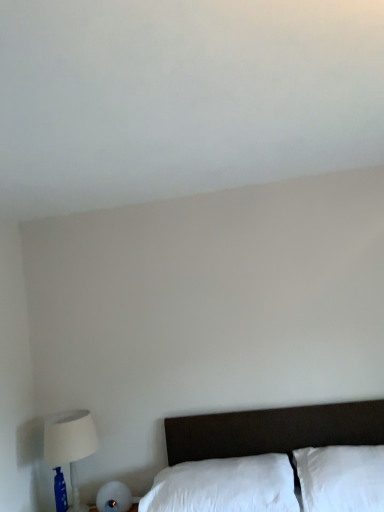
Question: From a real-world perspective, is white soft pillow at lower center, positioned as the 1th pillow in left-to-right order, located beneath white fabric lampshade at left?

Choices:
 (A) no
 (B) yes

Answer: (B)

Question: Is white soft pillow at lower center, the second pillow in the right-to-left sequence, smaller than white fabric lampshade at left?

Choices:
 (A) no
 (B) yes

Answer: (A)

Question: Considering the relative sizes of white soft pillow at lower center, the second pillow in the right-to-left sequence, and white fabric lampshade at left in the image provided, is white soft pillow at lower center, the second pillow in the right-to-left sequence, bigger than white fabric lampshade at left?

Choices:
 (A) yes
 (B) no

Answer: (A)

Question: From the image's perspective, is white soft pillow at lower center, positioned as the 1th pillow in left-to-right order, below white fabric lampshade at left?

Choices:
 (A) no
 (B) yes

Answer: (B)

Question: Could you tell me if white soft pillow at lower center, the second pillow in the right-to-left sequence, is turned towards white fabric lampshade at left?

Choices:
 (A) no
 (B) yes

Answer: (A)

Question: Visually, is white fabric lampshade at left positioned to the left or to the right of white soft pillow at lower right, which is the second pillow in left-to-right order?

Choices:
 (A) right
 (B) left

Answer: (B)

Question: Is point (51, 433) closer or farther from the camera than point (329, 462)?

Choices:
 (A) farther
 (B) closer

Answer: (A)

Question: Do you think white fabric lampshade at left is within white soft pillow at lower right, the first pillow viewed from the right, or outside of it?

Choices:
 (A) outside
 (B) inside

Answer: (A)

Question: In the image, is white fabric lampshade at left positioned in front of or behind white soft pillow at lower right, which is the second pillow in left-to-right order?

Choices:
 (A) front
 (B) behind

Answer: (B)

Question: From the image's perspective, relative to white fabric lampshade at left, is white soft pillow at lower right, which is the second pillow in left-to-right order, above or below?

Choices:
 (A) above
 (B) below

Answer: (A)

Question: Would you say white soft pillow at lower right, the first pillow viewed from the right, is to the left or to the right of white fabric lampshade at left in the picture?

Choices:
 (A) left
 (B) right

Answer: (B)

Question: Considering the positions of white soft pillow at lower right, the first pillow viewed from the right, and white fabric lampshade at left in the image, is white soft pillow at lower right, the first pillow viewed from the right, wider or thinner than white fabric lampshade at left?

Choices:
 (A) thin
 (B) wide

Answer: (B)

Question: From their relative heights in the image, would you say white soft pillow at lower right, which is the second pillow in left-to-right order, is taller or shorter than white fabric lampshade at left?

Choices:
 (A) short
 (B) tall

Answer: (A)

Question: From the image's perspective, is white soft pillow at lower right, which is the second pillow in left-to-right order, positioned above or below white soft pillow at lower center, the second pillow in the right-to-left sequence?

Choices:
 (A) below
 (B) above

Answer: (B)

Question: Choose the correct answer: Is white soft pillow at lower right, the first pillow viewed from the right, inside white soft pillow at lower center, the second pillow in the right-to-left sequence, or outside it?

Choices:
 (A) inside
 (B) outside

Answer: (B)